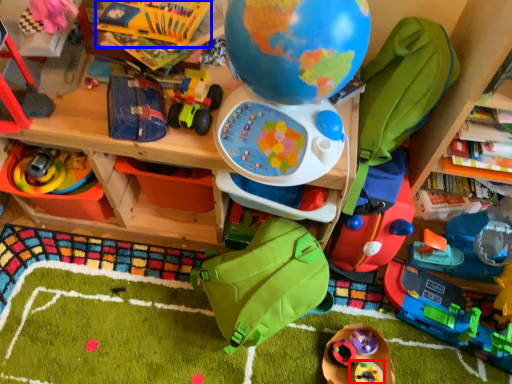
Question: Which object is closer to the camera taking this photo, toy (highlighted by a red box) or toy (highlighted by a blue box)?

Choices:
 (A) toy
 (B) toy

Answer: (B)